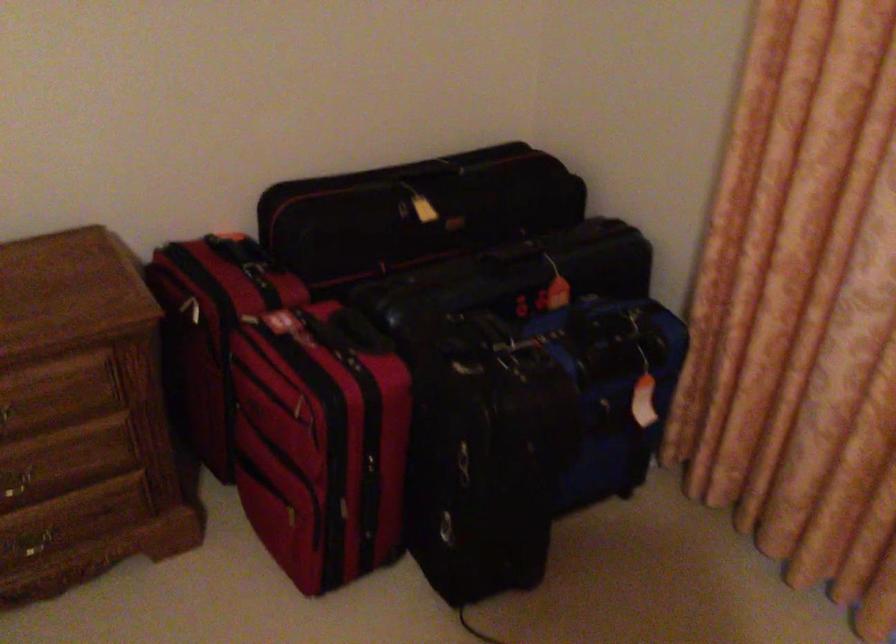
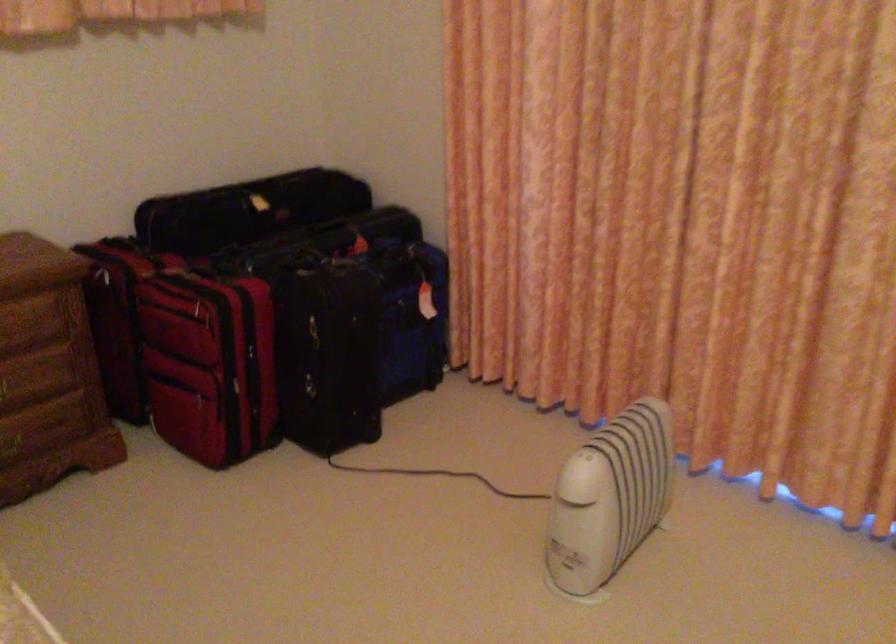
Question: The images are taken continuously from a first-person perspective. In which direction is your viewpoint rotating?

Choices:
 (A) Left
 (B) Right
 (C) Up
 (D) Down

Answer: (B)